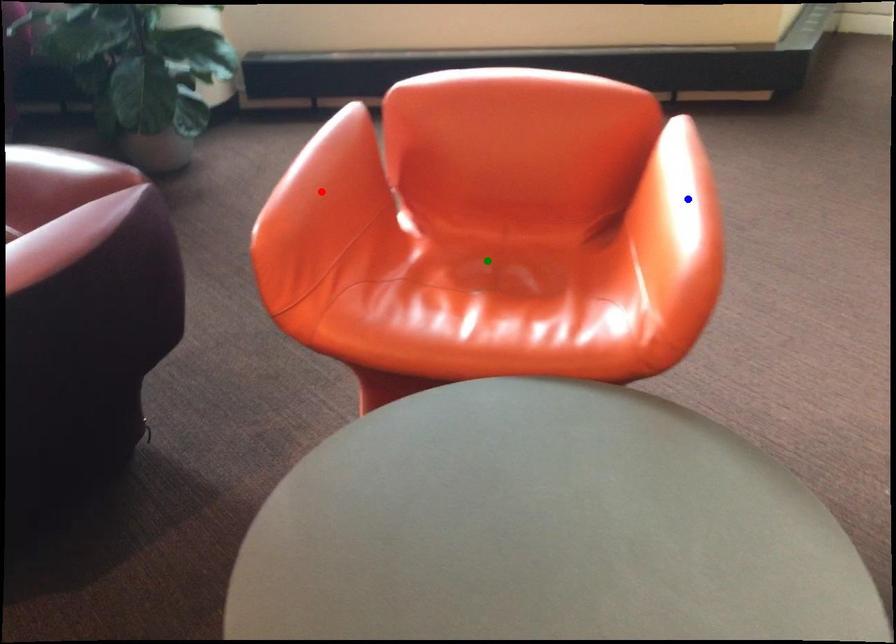
Order these from nearest to farthest:
A) green point
B) blue point
C) red point

1. blue point
2. red point
3. green point